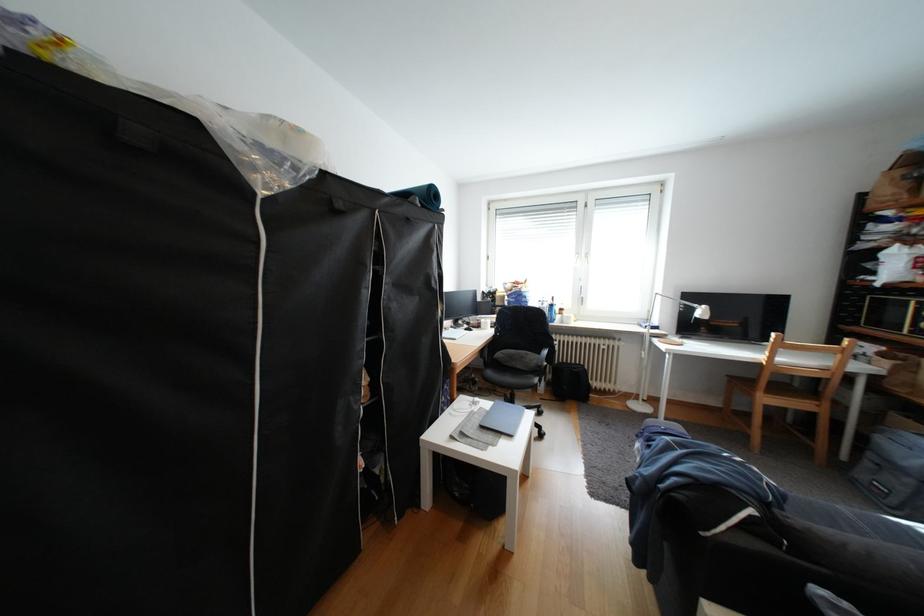
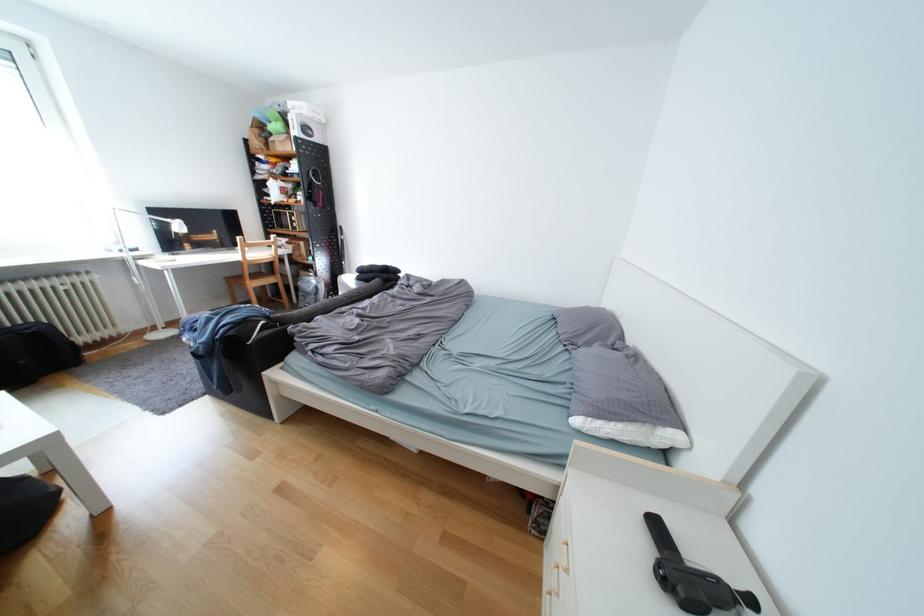
Where in the second image is the point corresponding to the point at 882,456 from the first image?

(313, 294)